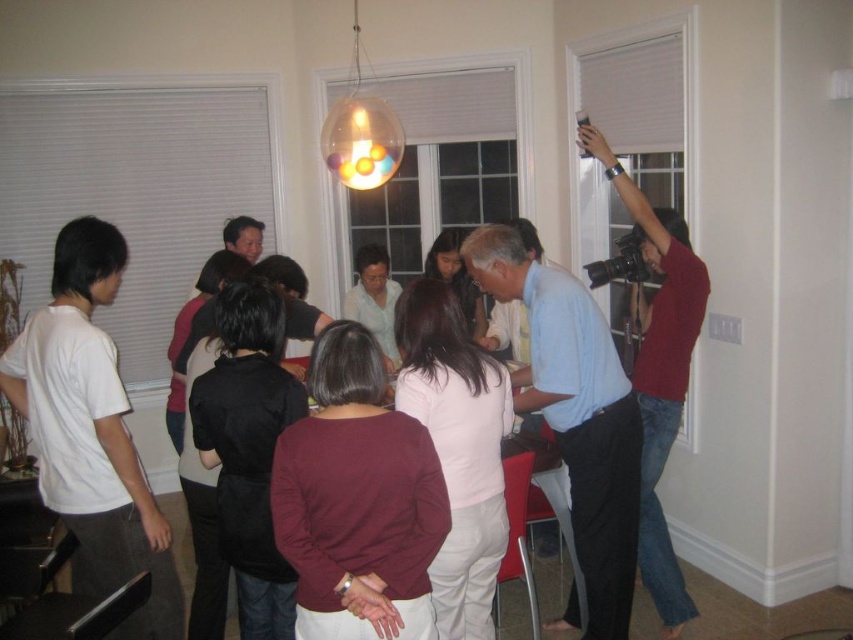
Question: Which point appears closest to the camera in this image?

Choices:
 (A) (422, 564)
 (B) (122, 396)
 (C) (643, 209)

Answer: (A)

Question: Does burgundy fabric blouse at center come in front of red sweater at upper right?

Choices:
 (A) no
 (B) yes

Answer: (B)

Question: Which of the following is the closest to the observer?

Choices:
 (A) red sweater at upper right
 (B) white cotton t-shirt at left
 (C) burgundy fabric blouse at center

Answer: (C)

Question: Is burgundy fabric blouse at center positioned before red sweater at upper right?

Choices:
 (A) yes
 (B) no

Answer: (A)

Question: Among these objects, which one is farthest from the camera?

Choices:
 (A) burgundy fabric blouse at center
 (B) red sweater at upper right
 (C) white cotton t-shirt at left

Answer: (B)

Question: Is burgundy fabric blouse at center to the right of red sweater at upper right from the viewer's perspective?

Choices:
 (A) yes
 (B) no

Answer: (B)